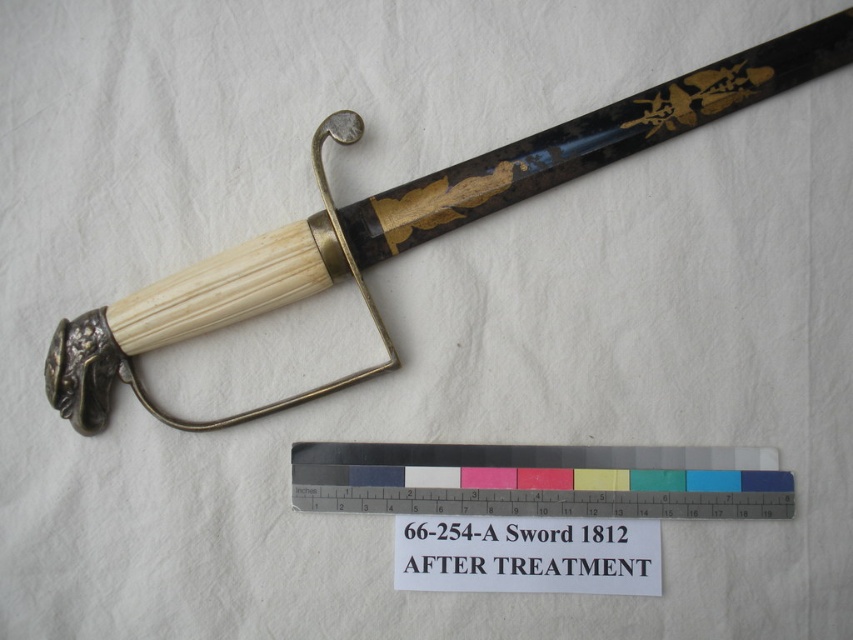
Between point (525, 193) and point (656, 552), which one is positioned in front?

Positioned in front is point (656, 552).

Describe the element at coordinates (402, 225) in the screenshot. I see `matte black sword at upper center` at that location.

Which is in front, point (172, 426) or point (595, 524)?

Positioned in front is point (172, 426).

You are a GUI agent. You are given a task and a screenshot of the screen. Output one action in this format:
    pyautogui.click(x=<x>, y=<y>)
    Task: Click on the matte black sword at upper center
    This screenshot has width=853, height=640.
    Given the screenshot: What is the action you would take?
    pyautogui.click(x=402, y=225)

Does metallic ruler at center appear on the left side of black paper sign at lower center?

Incorrect, metallic ruler at center is not on the left side of black paper sign at lower center.

Does metallic ruler at center have a larger size compared to black paper sign at lower center?

Yes.

What do you see at coordinates (541, 481) in the screenshot? The image size is (853, 640). I see `metallic ruler at center` at bounding box center [541, 481].

I want to click on metallic ruler at center, so click(541, 481).

Which of these two, matte black sword at upper center or metallic ruler at center, stands shorter?

With less height is metallic ruler at center.

Which is more to the left, matte black sword at upper center or metallic ruler at center?

matte black sword at upper center is more to the left.

Describe the element at coordinates (402, 225) in the screenshot. The image size is (853, 640). I see `matte black sword at upper center` at that location.

You are a GUI agent. You are given a task and a screenshot of the screen. Output one action in this format:
    pyautogui.click(x=<x>, y=<y>)
    Task: Click on the matte black sword at upper center
    This screenshot has width=853, height=640.
    Given the screenshot: What is the action you would take?
    pyautogui.click(x=402, y=225)